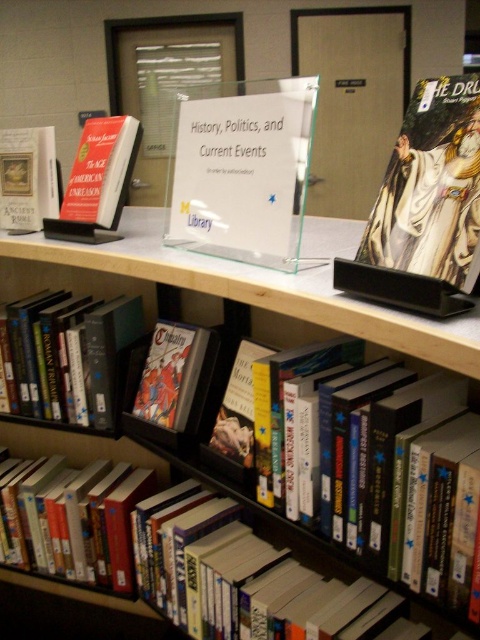
Looking at this image, is hardcover book at center taller than hardcover book at left?

Indeed, hardcover book at center has a greater height compared to hardcover book at left.

This screenshot has width=480, height=640. Describe the element at coordinates (69, 356) in the screenshot. I see `hardcover book at center` at that location.

This screenshot has height=640, width=480. What are the coordinates of `hardcover book at center` in the screenshot? It's located at (69, 356).

Between point (214, 285) and point (155, 371), which one is positioned behind?

Point (155, 371)

Is hardcover books at center thinner than matte plastic comic book at center?

Incorrect, hardcover books at center's width is not less than matte plastic comic book at center's.

Locate an element on the screen. The image size is (480, 640). hardcover books at center is located at coordinates pyautogui.click(x=267, y=284).

The height and width of the screenshot is (640, 480). I want to click on hardcover books at center, so click(267, 284).

Is hardcover comic book at upper right smaller than hardcover books at center?

Correct, hardcover comic book at upper right occupies less space than hardcover books at center.

This screenshot has width=480, height=640. What do you see at coordinates (424, 208) in the screenshot? I see `hardcover comic book at upper right` at bounding box center [424, 208].

Identify the location of hardcover comic book at upper right. (424, 208).